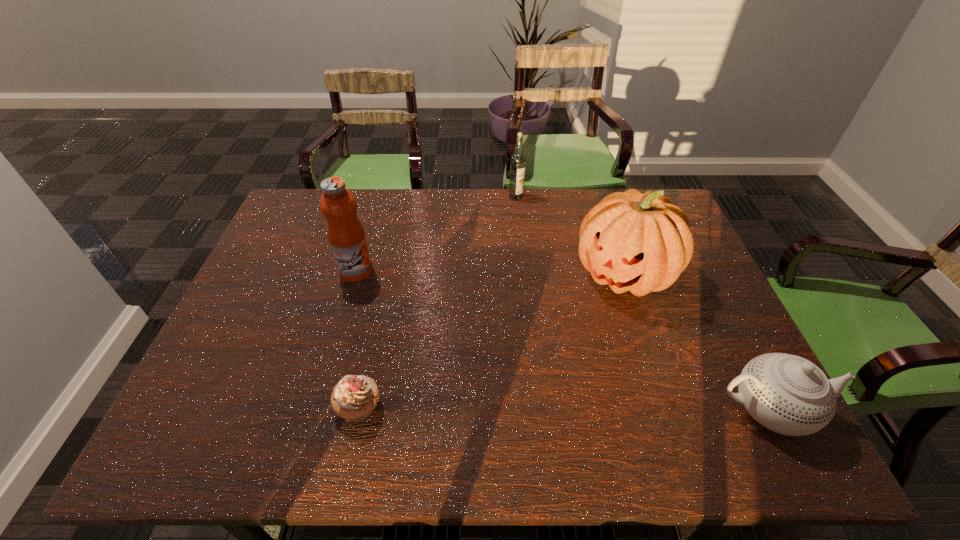
Locate an element on the screen. This screenshot has height=540, width=960. vacant space located on the label of the third shortest object is located at coordinates (521, 213).

This screenshot has height=540, width=960. Find the location of `free space located on the label of the third shortest object`. free space located on the label of the third shortest object is located at coordinates click(531, 242).

Find the location of a particular element. This screenshot has width=960, height=540. free space located on the label of the third shortest object is located at coordinates (526, 228).

The width and height of the screenshot is (960, 540). Find the location of `vacant space positioned 0.210m on the carved face of the pumpkin`. vacant space positioned 0.210m on the carved face of the pumpkin is located at coordinates (554, 352).

Where is `free location located on the carved face of the pumpkin`? free location located on the carved face of the pumpkin is located at coordinates (561, 344).

Locate an element on the screen. The height and width of the screenshot is (540, 960). vacant area situated on the carved face of the pumpkin is located at coordinates (532, 376).

Locate an element on the screen. The height and width of the screenshot is (540, 960). object located in the far edge section of the desktop is located at coordinates (518, 160).

The width and height of the screenshot is (960, 540). I want to click on cupcake situated at the near edge, so click(354, 398).

This screenshot has width=960, height=540. Identify the location of chinaware that is at the near edge. (787, 394).

The width and height of the screenshot is (960, 540). In order to click on chinaware located at the right edge in this screenshot , I will do `click(787, 394)`.